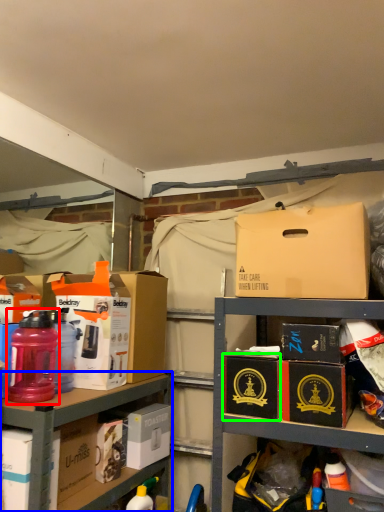
Question: Considering the real-world distances, which object is closest to bottle (highlighted by a red box)? shelf (highlighted by a blue box) or cardboard box (highlighted by a green box).

Choices:
 (A) shelf
 (B) cardboard box

Answer: (A)